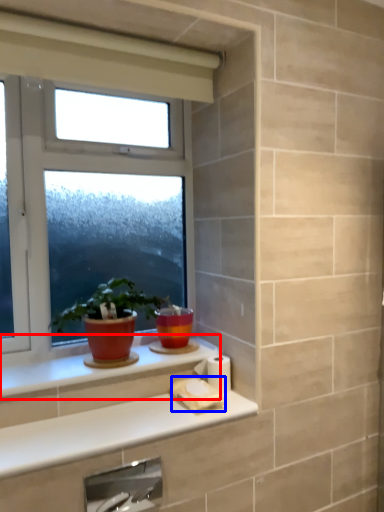
Question: Which object appears farthest to the camera in this image, window sill (highlighted by a red box) or toilet paper (highlighted by a blue box)?

Choices:
 (A) window sill
 (B) toilet paper

Answer: (B)